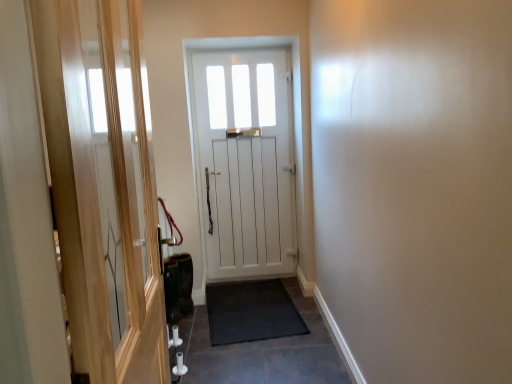
Question: Are black rubber doormat at center and white wooden door at center located far from each other?

Choices:
 (A) no
 (B) yes

Answer: (A)

Question: Is white wooden door at center surrounded by black rubber doormat at center?

Choices:
 (A) yes
 (B) no

Answer: (B)

Question: Can you confirm if black rubber doormat at center is positioned to the right of white wooden door at center?

Choices:
 (A) no
 (B) yes

Answer: (B)

Question: Is black rubber doormat at center bigger than white wooden door at center?

Choices:
 (A) no
 (B) yes

Answer: (A)

Question: Does black rubber doormat at center have a lesser height compared to white wooden door at center?

Choices:
 (A) no
 (B) yes

Answer: (B)

Question: From a real-world perspective, is black rubber doormat at center below white wooden door at center?

Choices:
 (A) yes
 (B) no

Answer: (A)

Question: Is black rubber mat at center not within black rubber doormat at center?

Choices:
 (A) no
 (B) yes

Answer: (A)

Question: From the image's perspective, would you say black rubber mat at center is shown under black rubber doormat at center?

Choices:
 (A) no
 (B) yes

Answer: (B)

Question: Does black rubber mat at center have a lesser height compared to black rubber doormat at center?

Choices:
 (A) yes
 (B) no

Answer: (A)

Question: Can black rubber doormat at center be found inside black rubber mat at center?

Choices:
 (A) yes
 (B) no

Answer: (A)

Question: Is black rubber mat at center to the left of black rubber doormat at center from the viewer's perspective?

Choices:
 (A) no
 (B) yes

Answer: (A)

Question: Is black rubber mat at center closer to the viewer compared to black rubber doormat at center?

Choices:
 (A) no
 (B) yes

Answer: (B)

Question: Considering the relative sizes of white wooden door at center and black rubber doormat at center in the image provided, is white wooden door at center thinner than black rubber doormat at center?

Choices:
 (A) yes
 (B) no

Answer: (A)